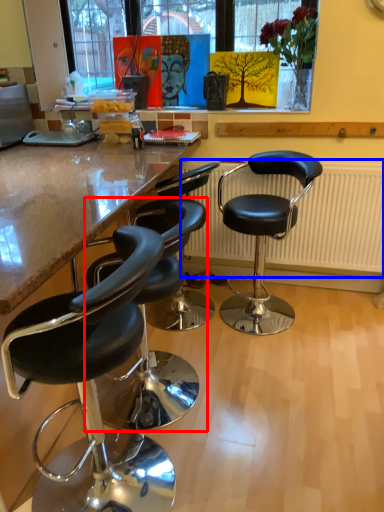
Question: Which object is closer to the camera taking this photo, chair (highlighted by a red box) or radiator (highlighted by a blue box)?

Choices:
 (A) chair
 (B) radiator

Answer: (A)